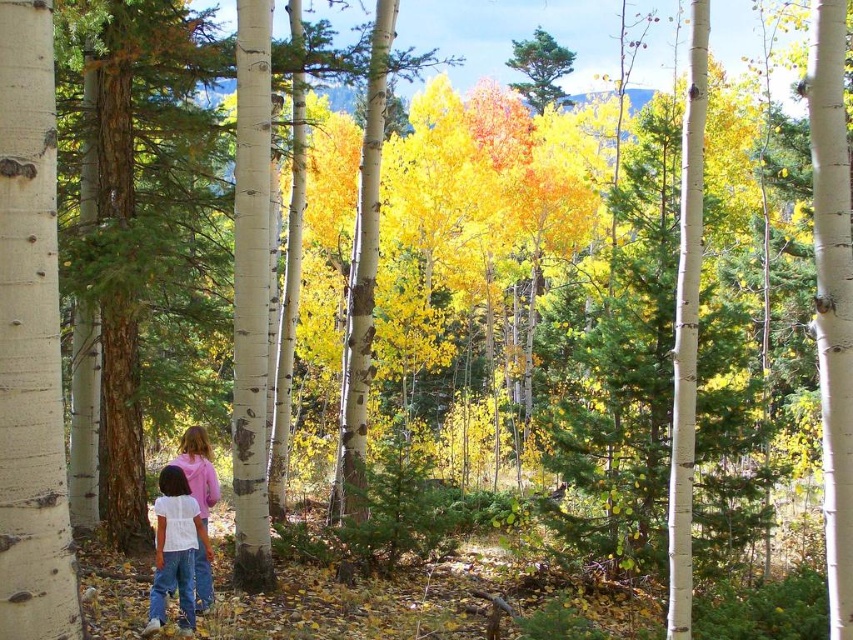
You are a photographer trying to capture a photo of the two people in the scene. The camera you are using has a focus range that can only capture objects within a 10 inch radius. Are both the white cotton shirt at lower center and the white cotton shirt at center in focus at the same time?

The white cotton shirt at lower center and white cotton shirt at center are 12.04 inches apart, which exceeds the camera focus range of 10 inches. Therefore, both cannot be in focus simultaneously.

You are a hiker who wants to take a photo of both the white cotton shirt at lower center and the white cotton shirt at center in the autumn forest scene. Since you can only focus on one subject at a time, which shirt should you focus on first to ensure the other remains in the background?

You should focus on the white cotton shirt at lower center first because it is closer to the viewer, allowing the white cotton shirt at center to stay in the background.